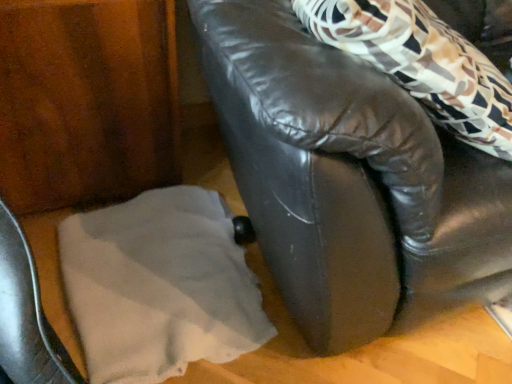
Question: In the image, is white fabric at lower left positioned in front of or behind black leather couch at center?

Choices:
 (A) front
 (B) behind

Answer: (B)

Question: In terms of height, does white fabric at lower left look taller or shorter compared to black leather couch at center?

Choices:
 (A) short
 (B) tall

Answer: (A)

Question: Is white fabric at lower left inside or outside of black leather couch at center?

Choices:
 (A) inside
 (B) outside

Answer: (B)

Question: Is point (506, 240) closer or farther from the camera than point (123, 215)?

Choices:
 (A) farther
 (B) closer

Answer: (B)

Question: In terms of width, does black leather couch at center look wider or thinner when compared to white fabric at lower left?

Choices:
 (A) wide
 (B) thin

Answer: (A)

Question: From their relative heights in the image, would you say black leather couch at center is taller or shorter than white fabric at lower left?

Choices:
 (A) short
 (B) tall

Answer: (B)

Question: Considering their positions, is black leather couch at center located in front of or behind white fabric at lower left?

Choices:
 (A) front
 (B) behind

Answer: (A)